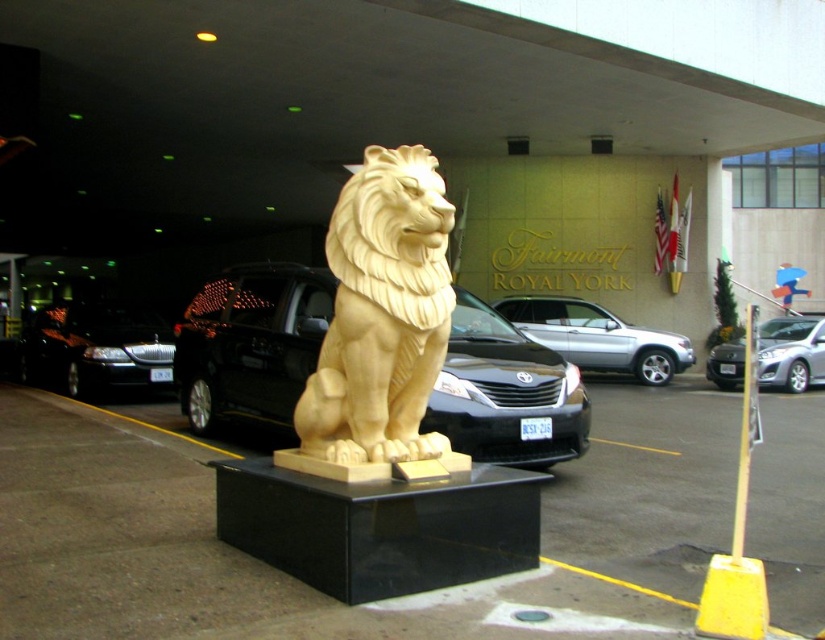
You are a tour guide explaining the historical significance of the Fairmont Royal York. You see the satin black car at center and the golden carved lion at center. Which object is positioned lower in the scene?

The satin black car at center is located below the golden carved lion at center, so the satin black car at center is positioned lower in the scene.

You are a delivery driver who needs to park your 1.5 meters tall delivery van. You see the satin black car at center and the golden carved lion at center in the parking area. Which object is shorter and suitable for parking next to without hitting the van?

The satin black car at center has a lesser height compared to the golden carved lion at center, so it is shorter and suitable for parking next to without hitting the van.

You are a tour guide explaining the statues in front of the Fairmont Royal York. You notice both the matte gold lion statue at center and the golden carved lion at center. Which one is wider?

The matte gold lion statue at center is wider than the golden carved lion at center.